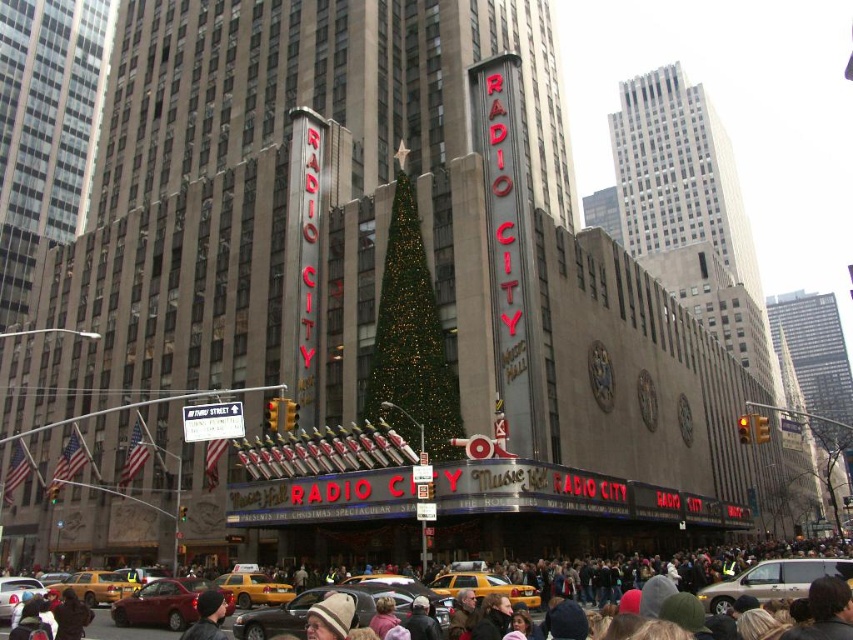
Question: Which point is closer to the camera taking this photo?

Choices:
 (A) (329, 628)
 (B) (195, 634)

Answer: (B)

Question: Is yellow metallic taxi at center further to camera compared to yellow rubber taxi cab at lower left?

Choices:
 (A) no
 (B) yes

Answer: (A)

Question: Is yellow rubber taxi cab at lower left thinner than dark brown fur coat at lower left?

Choices:
 (A) no
 (B) yes

Answer: (A)

Question: Which object appears farthest from the camera in this image?

Choices:
 (A) yellow metallic taxi at center
 (B) dark brown fur coat at lower left
 (C) yellow rubber taxi at lower center
 (D) dark gray knit cap at lower left

Answer: (C)

Question: Which object is positioned closest to the dark brown fur coat at lower left?

Choices:
 (A) dark gray knit cap at lower left
 (B) khaki fabric hat at center
 (C) yellow rubber taxi at lower center
 (D) yellow rubber taxi cab at lower left

Answer: (D)

Question: Is yellow rubber taxi cab at lower left smaller than khaki fabric hat at center?

Choices:
 (A) yes
 (B) no

Answer: (B)